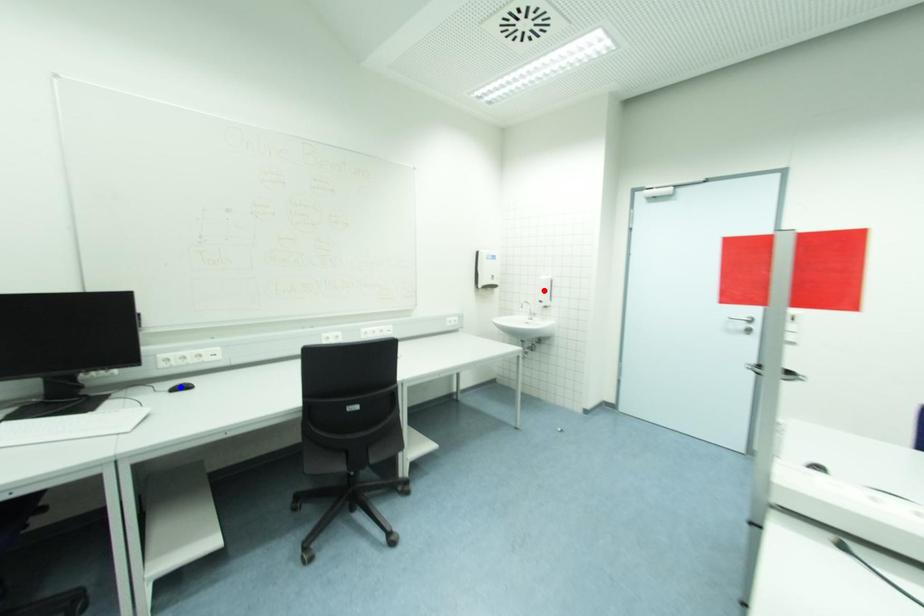
Question: Which of the two points in the image is closer to the camera?

Choices:
 (A) Blue point is closer.
 (B) Red point is closer.

Answer: (A)